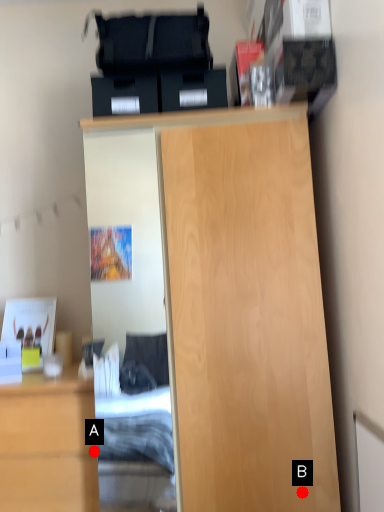
Question: Two points are circled on the image, labeled by A and B beside each circle. Which of the following is the closest to the observer?

Choices:
 (A) A is closer
 (B) B is closer

Answer: (B)